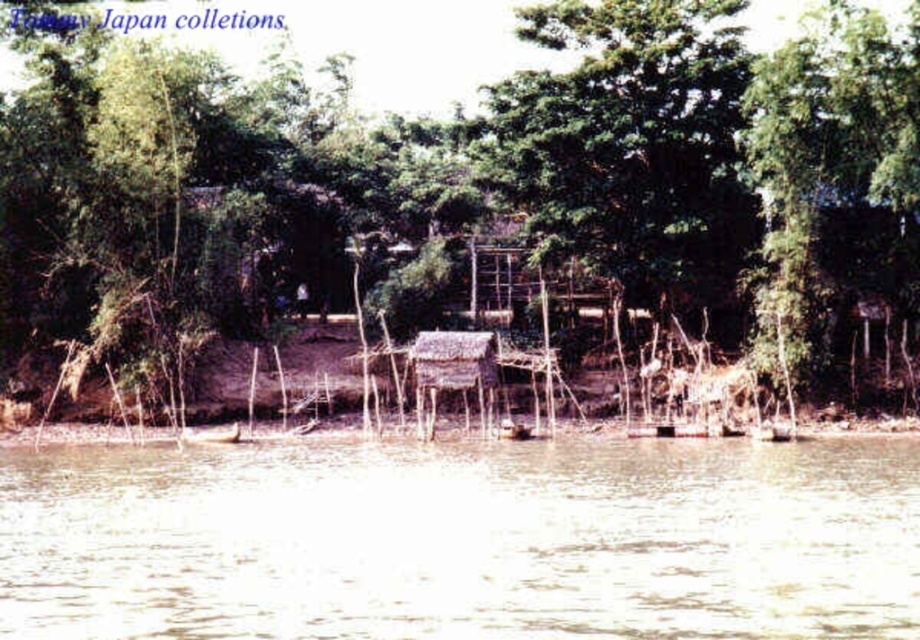
Question: Which point is closer to the camera?

Choices:
 (A) brown muddy water at lower center
 (B) green leafy tree at center

Answer: (A)

Question: Which of the following is the farthest from the observer?

Choices:
 (A) (817, 168)
 (B) (621, 589)

Answer: (A)

Question: Does green leafy tree at center have a smaller size compared to brown muddy water at lower center?

Choices:
 (A) yes
 (B) no

Answer: (B)

Question: Is green leafy tree at center positioned behind brown muddy water at lower center?

Choices:
 (A) yes
 (B) no

Answer: (A)

Question: Is green leafy tree at center wider than brown muddy water at lower center?

Choices:
 (A) yes
 (B) no

Answer: (A)